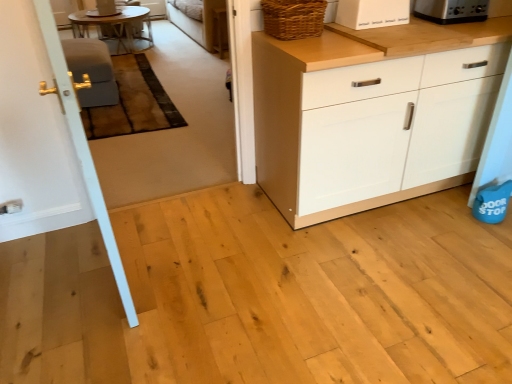
Question: Choose the correct answer: Is woven brown basket at upper right inside satin silver toaster at upper right, the 2th appliance when ordered from back to front, or outside it?

Choices:
 (A) outside
 (B) inside

Answer: (A)

Question: From their relative heights in the image, would you say woven brown basket at upper right is taller or shorter than satin silver toaster at upper right, marked as the 3th appliance in a left-to-right arrangement?

Choices:
 (A) short
 (B) tall

Answer: (B)

Question: Based on their relative distances, which object is nearer to the matte gray armchair at left?

Choices:
 (A) beige fabric couch at upper center
 (B) white wood cabinet at center
 (C) wooden round table at upper left
 (D) satin silver toaster at upper right, marked as the 3th appliance in a left-to-right arrangement
 (E) woven brown basket at upper right

Answer: (C)

Question: Which is nearer to the white matte bread box at upper right, which is the 2th appliance from left to right?

Choices:
 (A) wooden round table at upper left
 (B) white painted wood door at left
 (C) woven brown basket at upper right
 (D) matte gray armchair at left
 (E) beige fabric couch at upper center

Answer: (C)